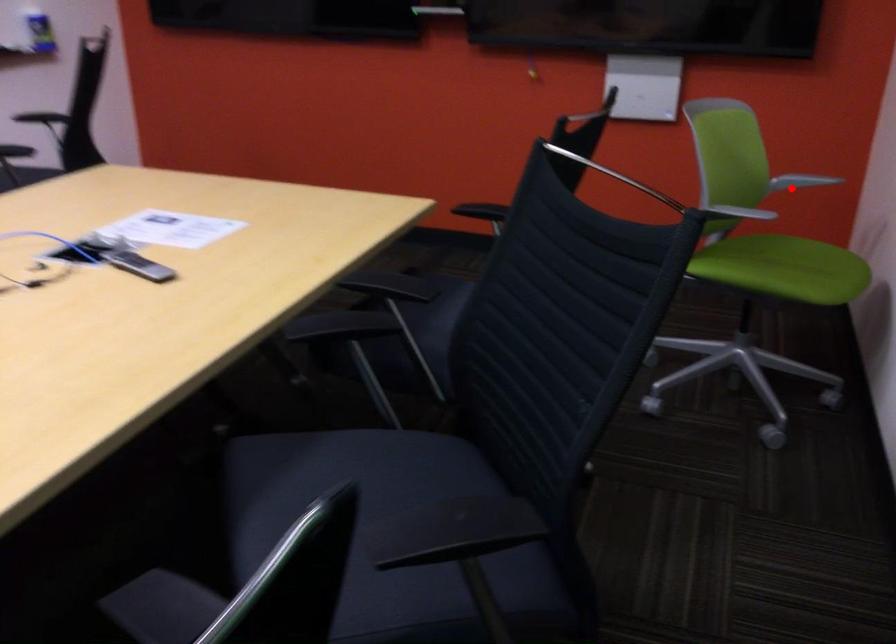
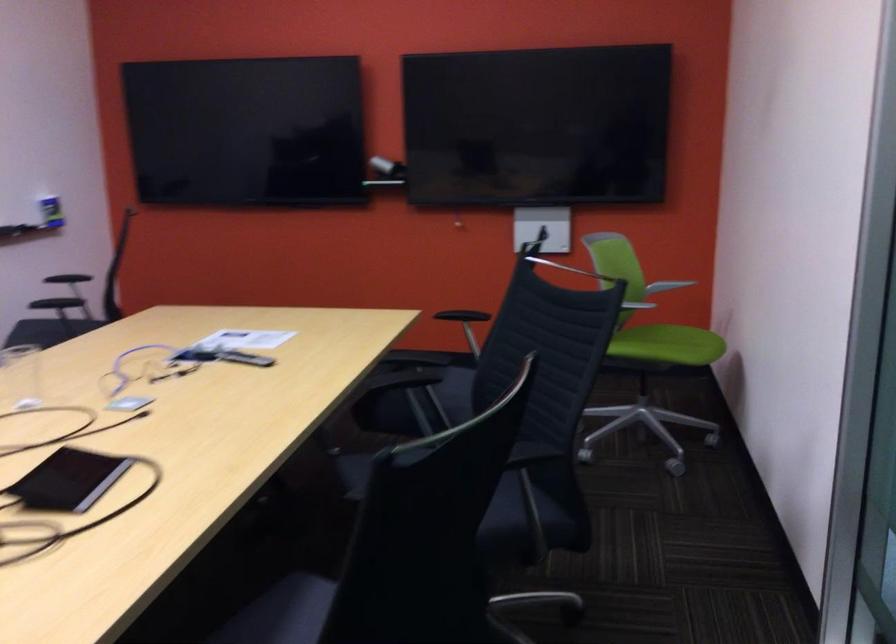
In the second image, find the point that corresponds to the highlighted location in the first image.

(666, 286)